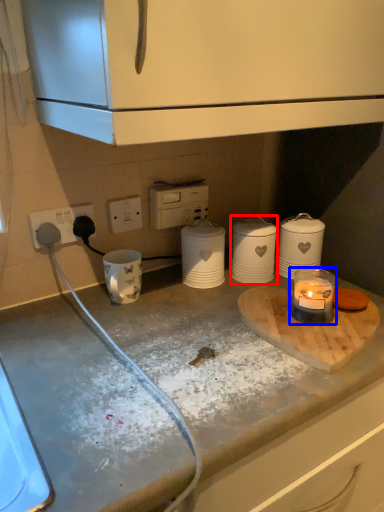
Question: Which object appears closest to the camera in this image, kitchen appliance (highlighted by a red box) or candle holder (highlighted by a blue box)?

Choices:
 (A) kitchen appliance
 (B) candle holder

Answer: (B)